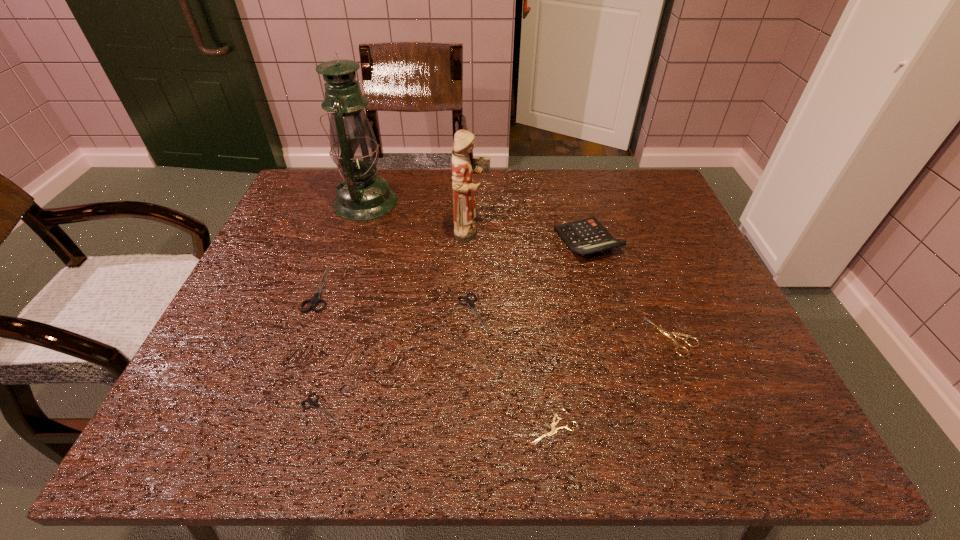
The width and height of the screenshot is (960, 540). I want to click on the tallest object, so click(x=362, y=195).

Identify the location of figurine. The width and height of the screenshot is (960, 540). (465, 228).

You are a GUI agent. You are given a task and a screenshot of the screen. Output one action in this format:
    pyautogui.click(x=<x>, y=<y>)
    Task: Click on the third tallest object
    The width and height of the screenshot is (960, 540).
    Given the screenshot: What is the action you would take?
    pyautogui.click(x=586, y=236)

The height and width of the screenshot is (540, 960). I want to click on the leftmost shears, so click(x=316, y=299).

At what (x,y) coordinates should I click in order to perform the action: click on the biggest black shears. Please return your answer as a coordinate pair (x, y). This screenshot has height=540, width=960. Looking at the image, I should click on (316, 299).

The width and height of the screenshot is (960, 540). I want to click on the rightmost black shears, so click(x=470, y=303).

Locate an element on the screen. the fourth shortest shears is located at coordinates (470, 303).

This screenshot has width=960, height=540. I want to click on the farther beige shears, so click(669, 335).

Where is `the rightmost shears`? The width and height of the screenshot is (960, 540). the rightmost shears is located at coordinates (669, 335).

Identify the location of the second shears from left to right. (313, 404).